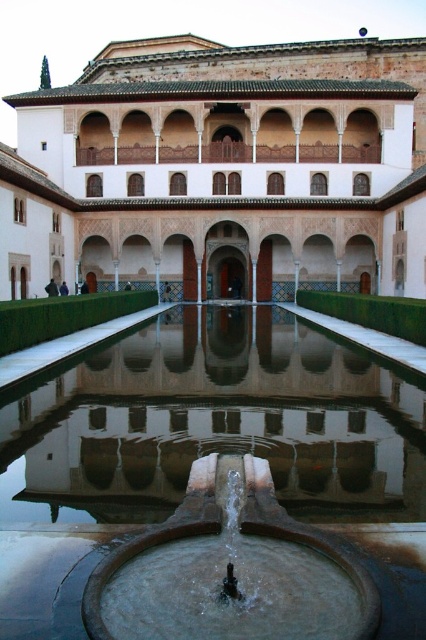
Question: From the image, what is the correct spatial relationship of stone wall at center in relation to bronze metallic fountain at center?

Choices:
 (A) right
 (B) left

Answer: (A)

Question: Considering the real-world distances, which object is closest to the brown stone fountain at center?

Choices:
 (A) stone wall at center
 (B) bronze metallic fountain at center

Answer: (B)

Question: Does stone wall at center lie behind bronze metallic fountain at center?

Choices:
 (A) no
 (B) yes

Answer: (B)

Question: Is stone wall at center bigger than bronze metallic fountain at center?

Choices:
 (A) no
 (B) yes

Answer: (B)

Question: Which object is the closest to the bronze metallic fountain at center?

Choices:
 (A) brown stone fountain at center
 (B) stone wall at center

Answer: (A)

Question: Which of the following is the farthest from the observer?

Choices:
 (A) stone wall at center
 (B) bronze metallic fountain at center

Answer: (A)